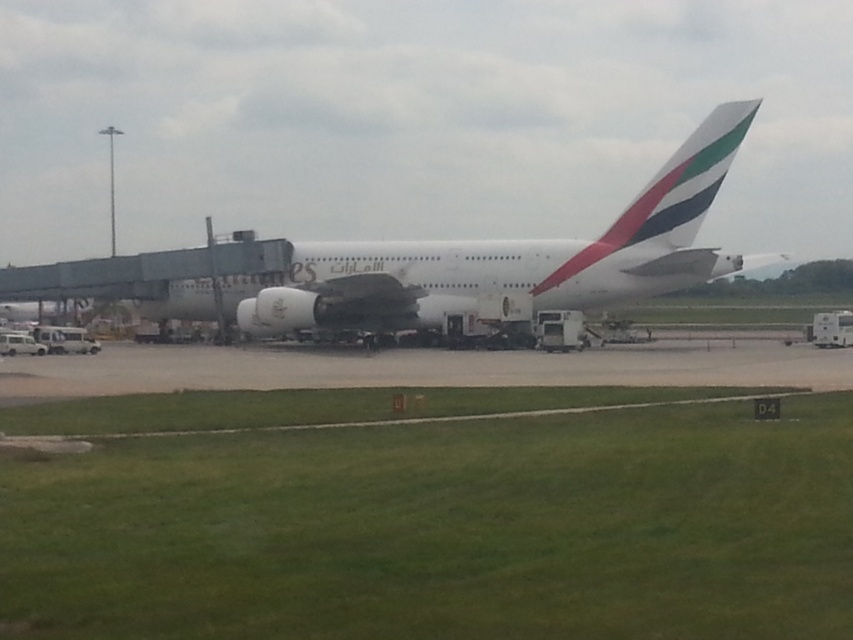
What do you see at coordinates (514, 257) in the screenshot? I see `white glossy airplane at center` at bounding box center [514, 257].

In the scene shown: Between white glossy airplane at center and white glossy tail at center, which one appears on the right side from the viewer's perspective?

white glossy tail at center

Where is `white glossy airplane at center`? white glossy airplane at center is located at coordinates click(x=514, y=257).

Consider the image. Is white glossy airplane at center further to the viewer compared to metallic silver jet engine at center?

No, it is not.

Who is more forward, (500, 298) or (381, 305)?

Point (500, 298) is more forward.

Who is more distant from viewer, (x=456, y=250) or (x=265, y=310)?

Positioned behind is point (x=456, y=250).

Locate an element on the screen. Image resolution: width=853 pixels, height=640 pixels. white glossy airplane at center is located at coordinates (514, 257).

Does point (669, 164) come closer to viewer compared to point (317, 291)?

Yes.

Does white glossy tail at center have a greater height compared to metallic silver jet engine at center?

Correct, white glossy tail at center is much taller as metallic silver jet engine at center.

In order to click on white glossy tail at center in this screenshot , I will do `click(668, 192)`.

Where is `white glossy tail at center`? white glossy tail at center is located at coordinates (668, 192).